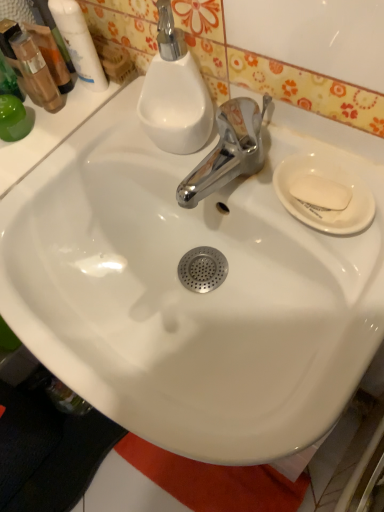
Question: Can you confirm if translucent plastic mouthwash at upper left, which is the second mouthwash in right-to-left order, is shorter than white glossy mouthwash at upper left, acting as the second mouthwash starting from the left?

Choices:
 (A) yes
 (B) no

Answer: (A)

Question: From the image's perspective, would you say translucent plastic mouthwash at upper left, which is the second mouthwash in right-to-left order, is shown under white glossy mouthwash at upper left, which is counted as the first mouthwash, starting from the right?

Choices:
 (A) yes
 (B) no

Answer: (A)

Question: Is translucent plastic mouthwash at upper left, which is the second mouthwash in right-to-left order, not inside white glossy mouthwash at upper left, acting as the second mouthwash starting from the left?

Choices:
 (A) no
 (B) yes

Answer: (B)

Question: Is translucent plastic mouthwash at upper left, the 1th mouthwash in the left-to-right sequence, aimed at white glossy mouthwash at upper left, acting as the second mouthwash starting from the left?

Choices:
 (A) no
 (B) yes

Answer: (A)

Question: Does translucent plastic mouthwash at upper left, which is the second mouthwash in right-to-left order, contain white glossy mouthwash at upper left, which is counted as the first mouthwash, starting from the right?

Choices:
 (A) yes
 (B) no

Answer: (B)

Question: Considering the relative sizes of translucent plastic mouthwash at upper left, the 1th mouthwash in the left-to-right sequence, and white glossy mouthwash at upper left, acting as the second mouthwash starting from the left, in the image provided, is translucent plastic mouthwash at upper left, the 1th mouthwash in the left-to-right sequence, smaller than white glossy mouthwash at upper left, acting as the second mouthwash starting from the left,?

Choices:
 (A) yes
 (B) no

Answer: (B)

Question: Would you say white matte soap at right is a long distance from white glossy mouthwash at upper left, acting as the second mouthwash starting from the left?

Choices:
 (A) no
 (B) yes

Answer: (A)

Question: Is white matte soap at right thinner than white glossy mouthwash at upper left, acting as the second mouthwash starting from the left?

Choices:
 (A) yes
 (B) no

Answer: (B)

Question: From the image's perspective, is white matte soap at right beneath white glossy mouthwash at upper left, which is counted as the first mouthwash, starting from the right?

Choices:
 (A) yes
 (B) no

Answer: (A)

Question: Considering the relative sizes of white matte soap at right and white glossy mouthwash at upper left, which is counted as the first mouthwash, starting from the right, in the image provided, is white matte soap at right taller than white glossy mouthwash at upper left, which is counted as the first mouthwash, starting from the right,?

Choices:
 (A) yes
 (B) no

Answer: (B)

Question: Is white matte soap at right facing towards white glossy mouthwash at upper left, acting as the second mouthwash starting from the left?

Choices:
 (A) no
 (B) yes

Answer: (A)

Question: From a real-world perspective, is white matte soap at right positioned over white glossy mouthwash at upper left, which is counted as the first mouthwash, starting from the right, based on gravity?

Choices:
 (A) no
 (B) yes

Answer: (A)

Question: Is white glossy mouthwash at upper left, which is counted as the first mouthwash, starting from the right, not within white matte soap at right?

Choices:
 (A) yes
 (B) no

Answer: (A)